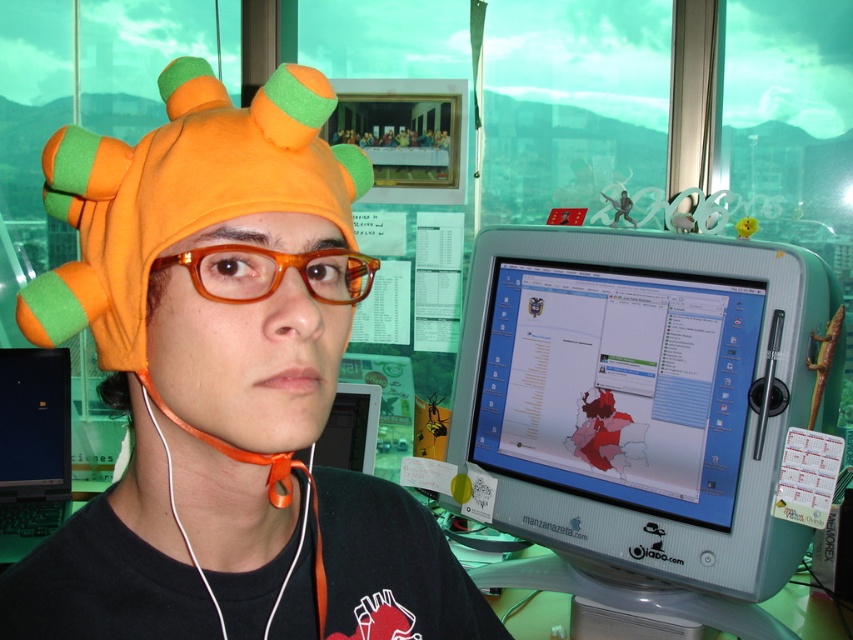
Question: Can you confirm if orange felt hat at left is wider than white earphone at lower left?

Choices:
 (A) yes
 (B) no

Answer: (A)

Question: Can you confirm if orange felt hat at left is positioned above white earphone at lower left?

Choices:
 (A) no
 (B) yes

Answer: (A)

Question: From the image, what is the correct spatial relationship of matte plastic monitor at center in relation to black glossy laptop at left?

Choices:
 (A) above
 (B) below

Answer: (A)

Question: Which object appears farthest from the camera in this image?

Choices:
 (A) orange fleece hat at center
 (B) orange felt hat at left

Answer: (A)

Question: Which object is the farthest from the white earphone at lower left?

Choices:
 (A) black glossy laptop at left
 (B) orange fleece hat at center
 (C) matte plastic monitor at center

Answer: (A)

Question: Among these points, which one is farthest from the camera?

Choices:
 (A) (86, 257)
 (B) (4, 452)

Answer: (B)